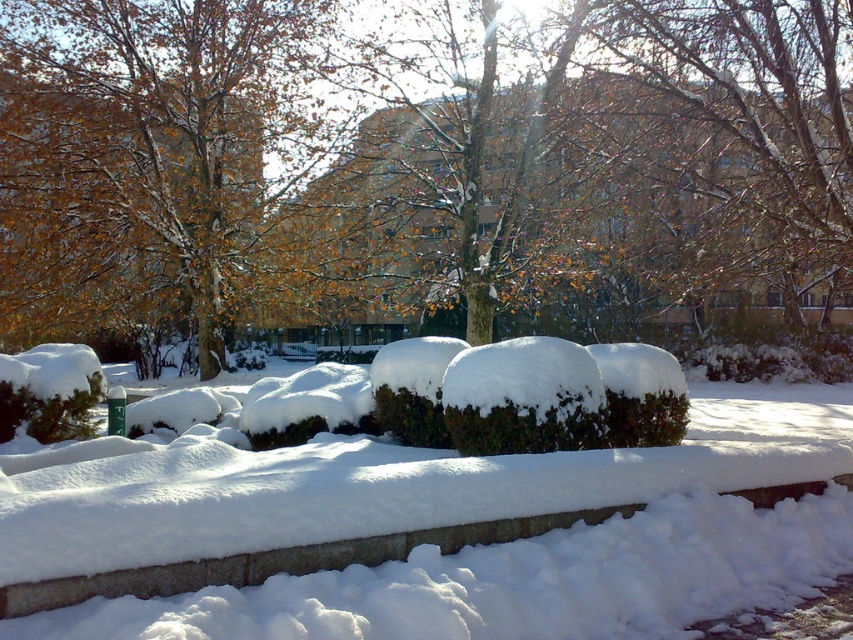
You are standing in the winter scene and want to walk towards both the point at coordinates (523, 529) and the point at coordinates (195, 227). Which point will you reach first?

You will reach the point at coordinates (523, 529) first because it is closer to you than the point at coordinates (195, 227).

You are standing at the edge of a snow covered stone wall in a winter park scene. You notice a point labeled at coordinates (396, 536). Based on the scene description, can you determine what this point is located on?

The point labeled at coordinates (396, 536) is on white fluffy snow at center.